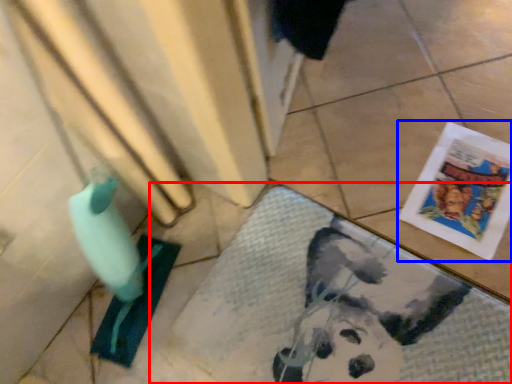
Question: Which point is closer to the camera, bath mat (highlighted by a red box) or comic book (highlighted by a blue box)?

Choices:
 (A) bath mat
 (B) comic book

Answer: (A)